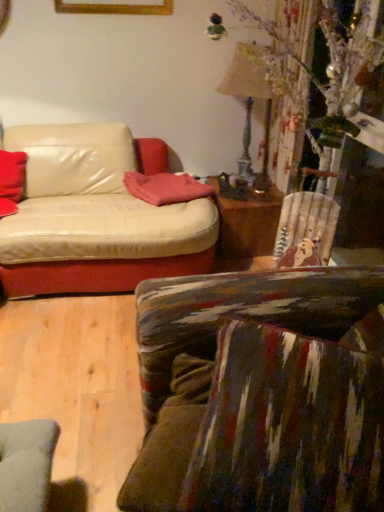
Measure the distance between point (4, 170) and camera.

Point (4, 170) and camera are 8.14 feet apart from each other.

In order to face metallic gold lamp at upper right, should I rotate leftwards or rightwards?

You should rotate right by 7.159 degrees.

What do you see at coordinates (165, 188) in the screenshot?
I see `pink fabric pillow at center, positioned as the 2th pillow in left-to-right order` at bounding box center [165, 188].

Locate an element on the screen. Image resolution: width=384 pixels, height=512 pixels. matte red cushion at left, the first pillow viewed from the left is located at coordinates (11, 180).

Is metallic gold lamp at upper right taller than matte red cushion at left, the first pillow viewed from the left?

Correct, metallic gold lamp at upper right is much taller as matte red cushion at left, the first pillow viewed from the left.

Could you tell me if metallic gold lamp at upper right is facing matte red cushion at left, arranged as the second pillow when viewed from the right?

No, metallic gold lamp at upper right is not facing towards matte red cushion at left, arranged as the second pillow when viewed from the right.

Is metallic gold lamp at upper right behind matte red cushion at left, the first pillow viewed from the left?

Yes.

From the image's perspective, relative to textured multicolored fabric couch at lower right, is metallic gold lamp at upper right above or below?

Clearly, from the image's perspective, metallic gold lamp at upper right is above textured multicolored fabric couch at lower right.

Between metallic gold lamp at upper right and textured multicolored fabric couch at lower right, which one is positioned in front?

Positioned in front is textured multicolored fabric couch at lower right.

From the picture: Between metallic gold lamp at upper right and textured multicolored fabric couch at lower right, which one has more height?

Standing taller between the two is metallic gold lamp at upper right.

Considering the relative positions of pink fabric pillow at center, positioned as the 2th pillow in left-to-right order, and metallic gold lamp at upper right in the image provided, is pink fabric pillow at center, positioned as the 2th pillow in left-to-right order, to the left or to the right of metallic gold lamp at upper right?

pink fabric pillow at center, positioned as the 2th pillow in left-to-right order, is to the left of metallic gold lamp at upper right.

Is pink fabric pillow at center, which is the 1th pillow from right to left, outside of metallic gold lamp at upper right?

Yes, pink fabric pillow at center, which is the 1th pillow from right to left, is outside of metallic gold lamp at upper right.

How many degrees apart are the facing directions of pink fabric pillow at center, which is the 1th pillow from right to left, and metallic gold lamp at upper right?

The facing directions of pink fabric pillow at center, which is the 1th pillow from right to left, and metallic gold lamp at upper right are 46.5 degrees apart.

Can you confirm if pink fabric pillow at center, positioned as the 2th pillow in left-to-right order, is shorter than metallic gold lamp at upper right?

Correct, pink fabric pillow at center, positioned as the 2th pillow in left-to-right order, is not as tall as metallic gold lamp at upper right.

From the image's perspective, between wooden table at center and matte red cushion at left, the first pillow viewed from the left, which one is located above?

matte red cushion at left, the first pillow viewed from the left.

Between wooden table at center and matte red cushion at left, the first pillow viewed from the left, which one has larger width?

Wider between the two is wooden table at center.

Is matte red cushion at left, the first pillow viewed from the left, a part of wooden table at center?

Actually, matte red cushion at left, the first pillow viewed from the left, is outside wooden table at center.

Is wooden table at center smaller than matte red cushion at left, arranged as the second pillow when viewed from the right?

Actually, wooden table at center might be larger than matte red cushion at left, arranged as the second pillow when viewed from the right.

Who is shorter, textured multicolored fabric couch at lower right or wooden table at center?

Standing shorter between the two is wooden table at center.

From the image's perspective, does textured multicolored fabric couch at lower right appear lower than wooden table at center?

Yes, from the image's perspective, textured multicolored fabric couch at lower right is below wooden table at center.

Can you confirm if textured multicolored fabric couch at lower right is positioned to the left of wooden table at center?

Yes.

From a real-world perspective, is textured multicolored fabric couch at lower right positioned above or below wooden table at center?

In terms of real-world spatial position, textured multicolored fabric couch at lower right is above wooden table at center.

Is point (1, 177) in front of point (227, 497)?

No.

Could you tell me if matte red cushion at left, arranged as the second pillow when viewed from the right, is turned towards textured multicolored fabric couch at lower right?

No.

From the image's perspective, between matte red cushion at left, the first pillow viewed from the left, and textured multicolored fabric couch at lower right, which one is located above?

matte red cushion at left, the first pillow viewed from the left, is shown above in the image.

In the image, is matte red cushion at left, arranged as the second pillow when viewed from the right, on the left side or the right side of textured multicolored fabric couch at lower right?

Based on their positions, matte red cushion at left, arranged as the second pillow when viewed from the right, is located to the left of textured multicolored fabric couch at lower right.

Does textured multicolored fabric couch at lower right have a larger size compared to matte red cushion at left, the first pillow viewed from the left?

Correct, textured multicolored fabric couch at lower right is larger in size than matte red cushion at left, the first pillow viewed from the left.

Looking at this image, can you see textured multicolored fabric couch at lower right touching matte red cushion at left, the first pillow viewed from the left?

textured multicolored fabric couch at lower right and matte red cushion at left, the first pillow viewed from the left, are not in contact.

Is textured multicolored fabric couch at lower right positioned beyond the bounds of matte red cushion at left, the first pillow viewed from the left?

Yes, textured multicolored fabric couch at lower right is located beyond the bounds of matte red cushion at left, the first pillow viewed from the left.

At what (x,y) coordinates should I click in order to perform the action: click on lamp behind the matte red cushion at left, arranged as the second pillow when viewed from the right. Please return your answer as a coordinate pair (x, y). Looking at the image, I should click on click(250, 96).

What are the coordinates of `studio couch located underneath the metallic gold lamp at upper right (from a real-world perspective)` in the screenshot? It's located at (261, 393).

Based on their spatial positions, is pink fabric pillow at center, which is the 1th pillow from right to left, or metallic gold lamp at upper right further from textured multicolored fabric couch at lower right?

The object further to textured multicolored fabric couch at lower right is metallic gold lamp at upper right.

Considering their positions, is matte red cushion at left, the first pillow viewed from the left, positioned further to textured multicolored fabric couch at lower right than wooden table at center?

matte red cushion at left, the first pillow viewed from the left, lies further to textured multicolored fabric couch at lower right than the other object.

From the image, which object appears to be farther from wooden table at center, pink fabric pillow at center, which is the 1th pillow from right to left, or metallic gold lamp at upper right?

metallic gold lamp at upper right.

Based on their spatial positions, is wooden table at center or textured multicolored fabric couch at lower right closer to metallic gold lamp at upper right?

wooden table at center is closer to metallic gold lamp at upper right.

Based on their spatial positions, is matte red cushion at left, arranged as the second pillow when viewed from the right, or wooden table at center closer to metallic gold lamp at upper right?

The object closer to metallic gold lamp at upper right is wooden table at center.

Estimate the real-world distances between objects in this image. Which object is further from metallic gold lamp at upper right, textured multicolored fabric couch at lower right or matte red cushion at left, arranged as the second pillow when viewed from the right?

textured multicolored fabric couch at lower right.

Which object lies nearer to the anchor point pink fabric pillow at center, which is the 1th pillow from right to left, textured multicolored fabric couch at lower right or metallic gold lamp at upper right?

metallic gold lamp at upper right is positioned closer to the anchor pink fabric pillow at center, which is the 1th pillow from right to left.

Estimate the real-world distances between objects in this image. Which object is closer to metallic gold lamp at upper right, pink fabric pillow at center, positioned as the 2th pillow in left-to-right order, or matte red cushion at left, the first pillow viewed from the left?

pink fabric pillow at center, positioned as the 2th pillow in left-to-right order, is closer to metallic gold lamp at upper right.

Image resolution: width=384 pixels, height=512 pixels. Find the location of `lamp between matte red cushion at left, the first pillow viewed from the left, and wooden table at center, in the horizontal direction`. lamp between matte red cushion at left, the first pillow viewed from the left, and wooden table at center, in the horizontal direction is located at coordinates coord(250,96).

What are the coordinates of `pillow situated between matte red cushion at left, the first pillow viewed from the left, and metallic gold lamp at upper right from left to right` in the screenshot? It's located at (165, 188).

Identify the location of pillow between textured multicolored fabric couch at lower right and pink fabric pillow at center, positioned as the 2th pillow in left-to-right order, along the z-axis. Image resolution: width=384 pixels, height=512 pixels. click(x=11, y=180).

Where is `lamp located between textured multicolored fabric couch at lower right and pink fabric pillow at center, which is the 1th pillow from right to left, in the depth direction`? The width and height of the screenshot is (384, 512). lamp located between textured multicolored fabric couch at lower right and pink fabric pillow at center, which is the 1th pillow from right to left, in the depth direction is located at coordinates (250, 96).